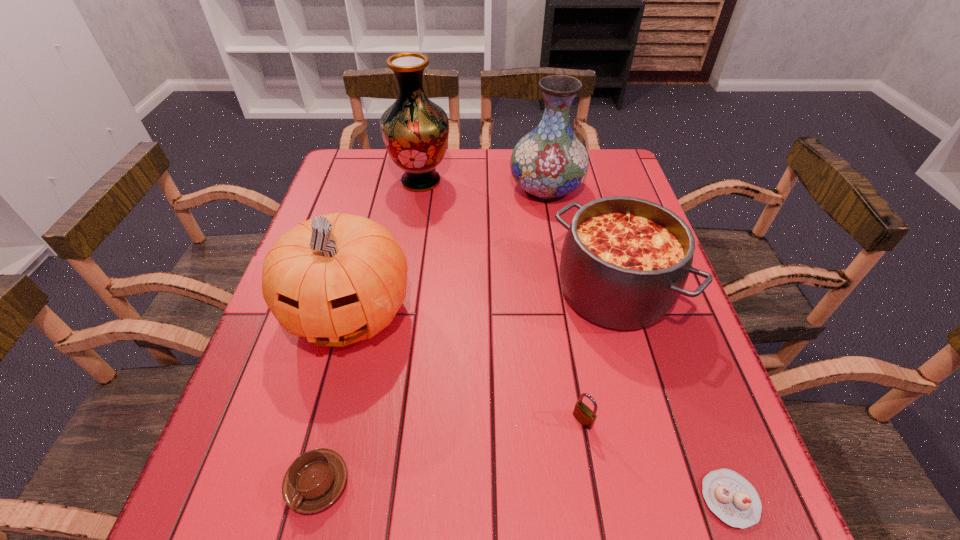
The image size is (960, 540). Identify the location of empty space that is in between the pumpkin and the shortest object. (540, 406).

I want to click on free space between the left vase and the padlock, so click(x=502, y=301).

The image size is (960, 540). I want to click on vacant point located between the right vase and the cupcake, so click(637, 344).

The width and height of the screenshot is (960, 540). In order to click on blank region between the cappuccino and the casserole in this screenshot , I will do tap(466, 387).

Image resolution: width=960 pixels, height=540 pixels. I want to click on vacant area that lies between the casserole and the left vase, so click(517, 236).

Locate an element on the screen. This screenshot has height=540, width=960. empty space that is in between the third tallest object and the casserole is located at coordinates 481,302.

The image size is (960, 540). Identify the location of unoccupied position between the right vase and the pumpkin. (447, 251).

This screenshot has height=540, width=960. What are the coordinates of `free space between the fourth tallest object and the second shortest object` in the screenshot? It's located at (466, 387).

Identify the location of object that is the third closest to the shortest object. This screenshot has width=960, height=540. (336, 279).

Locate an element on the screen. The image size is (960, 540). object that stands as the fifth closest to the padlock is located at coordinates (549, 162).